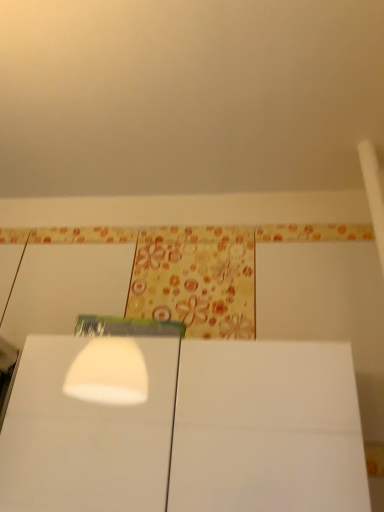
Image resolution: width=384 pixels, height=512 pixels. I want to click on white matte cabinet at center, so click(x=267, y=429).

What is the approximate height of white matte cabinet at center?

white matte cabinet at center is 11.61 inches in height.

The width and height of the screenshot is (384, 512). What do you see at coordinates (267, 429) in the screenshot?
I see `white matte cabinet at center` at bounding box center [267, 429].

Measure the distance between point (193, 344) and camera.

Point (193, 344) is 30.35 inches from camera.

Locate an element on the screen. white matte cabinet at center is located at coordinates (267, 429).